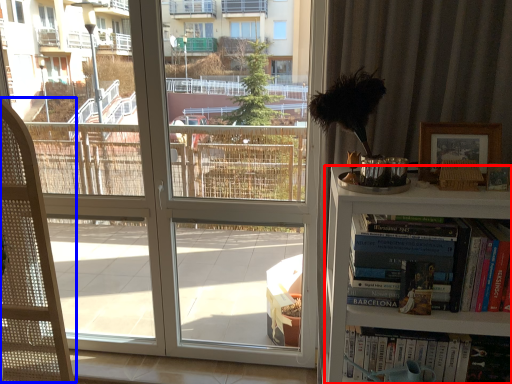
Question: Among these objects, which one is farthest to the camera, bookcase (highlighted by a red box) or folding chair (highlighted by a blue box)?

Choices:
 (A) bookcase
 (B) folding chair

Answer: (B)